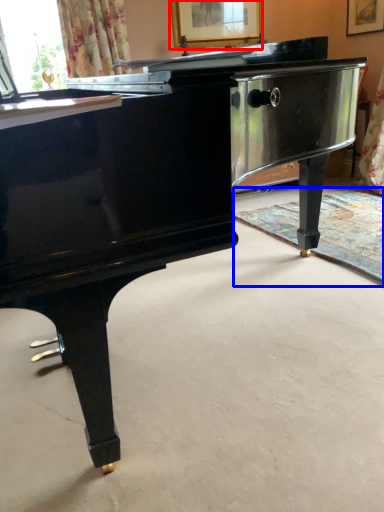
Question: Which object appears farthest to the camera in this image, picture frame (highlighted by a red box) or flat (highlighted by a blue box)?

Choices:
 (A) picture frame
 (B) flat

Answer: (A)